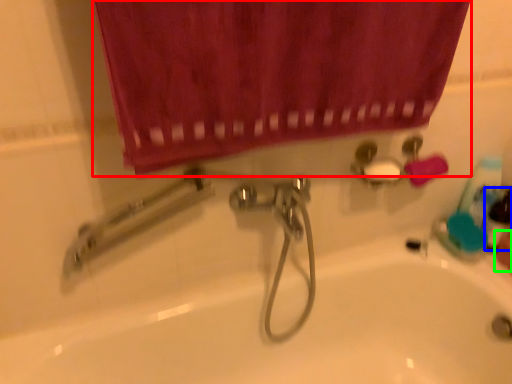
Question: Which object is positioned farthest from curtain (highlighted by a red box)? Select from mouthwash (highlighted by a blue box) and hand (highlighted by a green box).

Choices:
 (A) mouthwash
 (B) hand

Answer: (B)